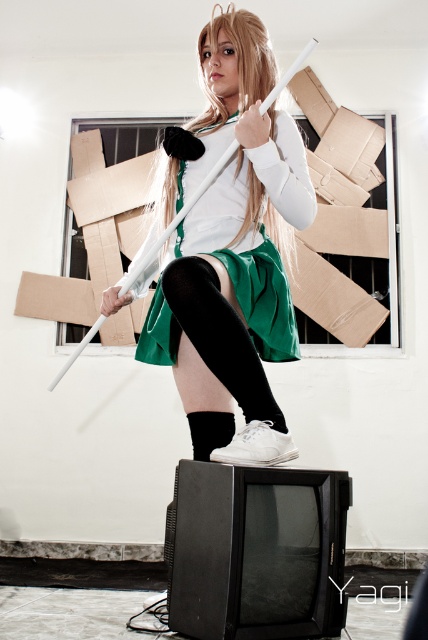
Question: Can you confirm if matte white sword at center is bigger than green fabric skirt at center?

Choices:
 (A) yes
 (B) no

Answer: (A)

Question: Which of the following is the farthest from the observer?

Choices:
 (A) (285, 147)
 (B) (267, 164)

Answer: (A)

Question: Which point is farther from the camera taking this photo?

Choices:
 (A) (216, 141)
 (B) (174, 360)

Answer: (B)

Question: Does matte white sword at center come in front of green fabric skirt at center?

Choices:
 (A) yes
 (B) no

Answer: (A)

Question: Does matte white sword at center appear on the right side of green fabric skirt at center?

Choices:
 (A) yes
 (B) no

Answer: (A)